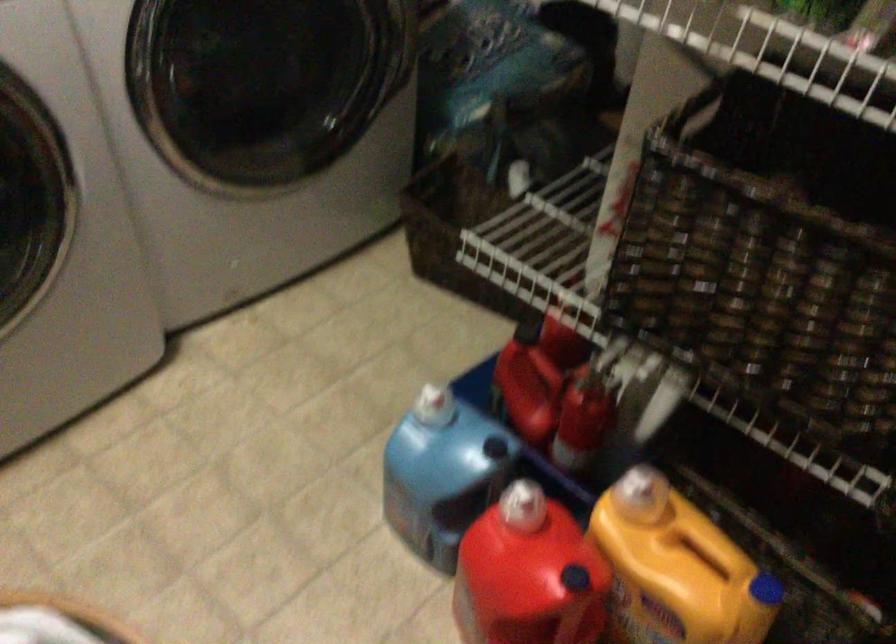
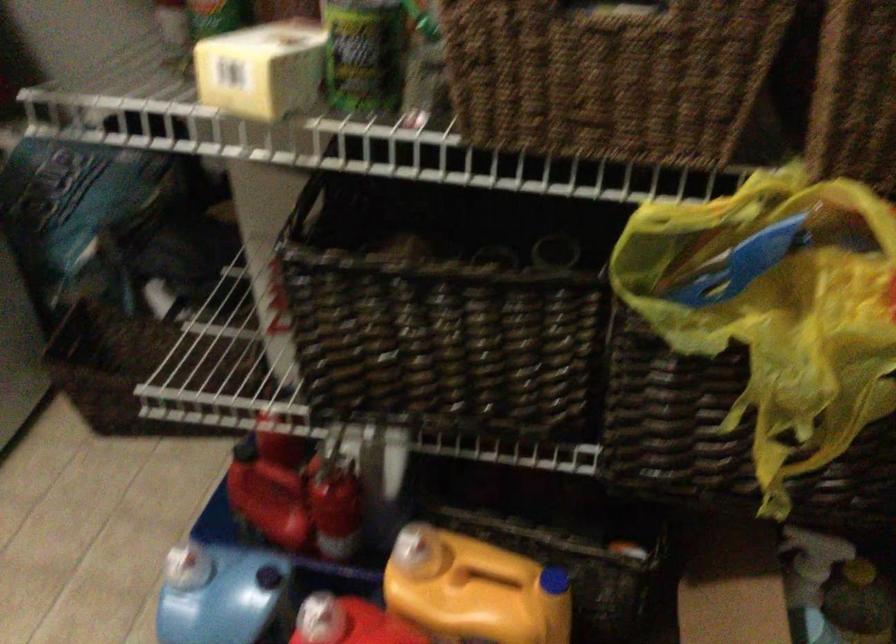
Find the pixel in the second image that matches (524,511) in the first image.

(320, 619)